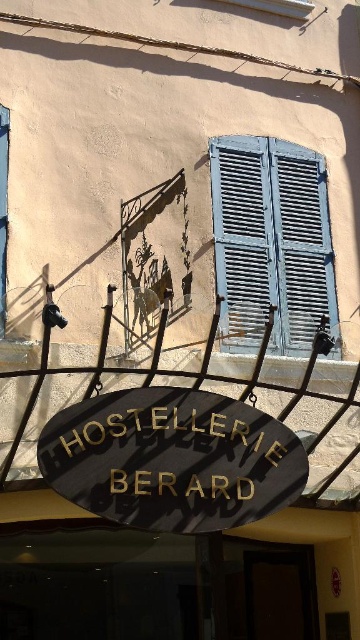
Question: Which object is closer to the camera taking this photo?

Choices:
 (A) goldmaterial/texturehostellerie berard sign at center
 (B) blue painted wood shutters at upper right

Answer: (A)

Question: Can you confirm if goldmaterial/texturehostellerie berard sign at center is positioned above blue painted wood shutters at upper right?

Choices:
 (A) no
 (B) yes

Answer: (A)

Question: Can you confirm if goldmaterial/texturehostellerie berard sign at center is thinner than blue painted wood shutters at upper right?

Choices:
 (A) yes
 (B) no

Answer: (B)

Question: Is goldmaterial/texturehostellerie berard sign at center below blue painted wood shutters at upper right?

Choices:
 (A) yes
 (B) no

Answer: (A)